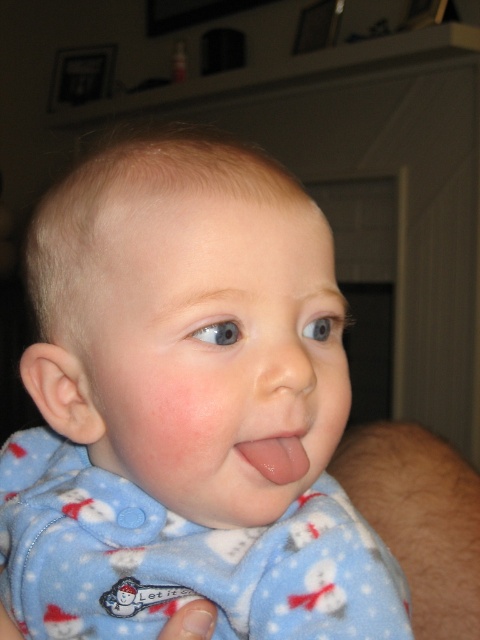
Based on the scene description, can you determine if the blue fleece pajamas at center are wider than the smooth flesh nose at center?

The blue fleece pajamas at center might be wider than smooth flesh nose at center according to the description.

In the image, you see a baby wearing blue fleece pajamas at center and a smooth flesh nose at center. Which object is located more to the left?

The blue fleece pajamas at center is positioned on the left side of smooth flesh nose at center, so the blue fleece pajamas at center is more to the left.

Based on the scene description, can you determine which object is located above the other between the smooth flesh nose at center and the glossy pink tongue at center?

The smooth flesh nose at center is positioned over the glossy pink tongue at center, meaning the nose is above the tongue.